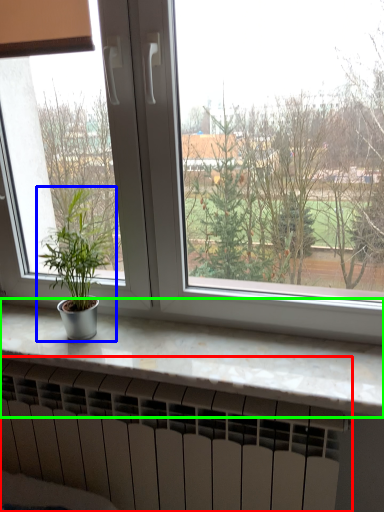
Question: Considering the real-world distances, which object is closest to heater (highlighted by a red box)? houseplant (highlighted by a blue box) or counter top (highlighted by a green box).

Choices:
 (A) houseplant
 (B) counter top

Answer: (B)